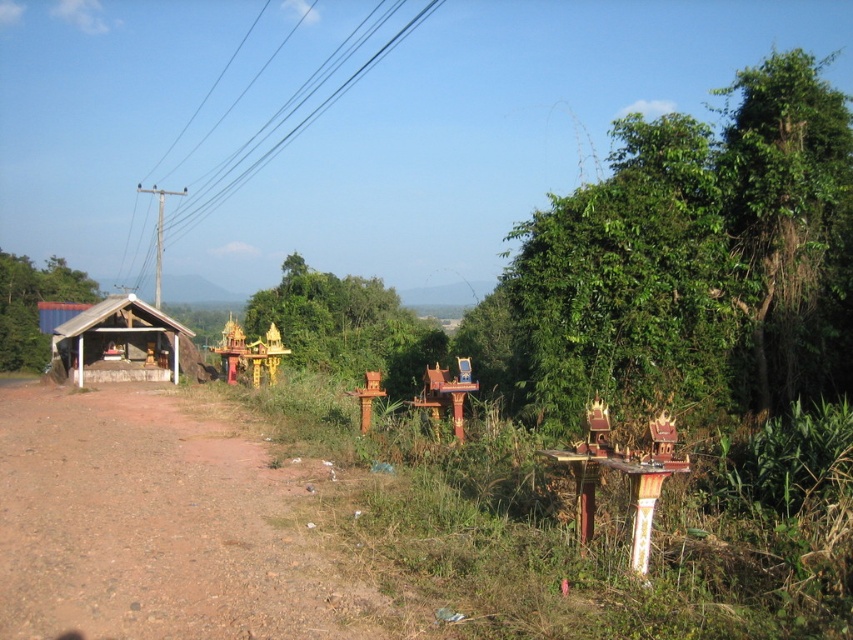
Question: Can you confirm if green leafy tree at center is positioned to the right of green leafy tree at left?

Choices:
 (A) yes
 (B) no

Answer: (A)

Question: Which is farther from the green leafy tree at center?

Choices:
 (A) wooden hut at left
 (B) black wire at upper left
 (C) green leafy tree at upper right
 (D) green leafy tree at left

Answer: (B)

Question: Which of the following is the farthest from the observer?

Choices:
 (A) black wire at upper left
 (B) green leafy tree at left

Answer: (A)

Question: Which point is farther to the camera?

Choices:
 (A) wooden hut at left
 (B) black wire at upper left

Answer: (B)

Question: In this image, where is green leafy tree at upper right located relative to green leafy tree at center?

Choices:
 (A) right
 (B) left

Answer: (A)

Question: Is green leafy tree at upper right to the right of wooden hut at left from the viewer's perspective?

Choices:
 (A) yes
 (B) no

Answer: (A)